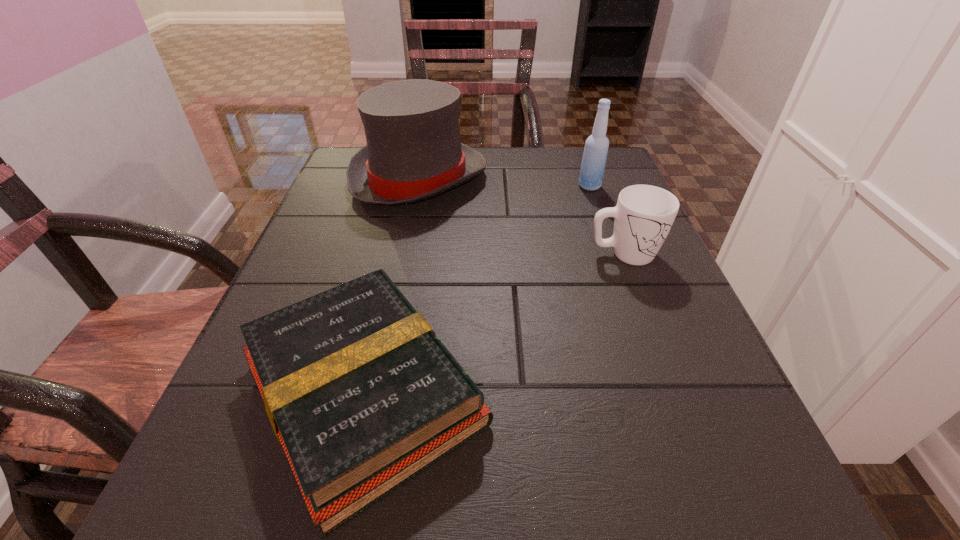
Find the location of a particular element. The image size is (960, 540). unoccupied area between the shortest object and the bottle is located at coordinates (477, 289).

Identify which object is the third nearest to the bottle. Please provide its 2D coordinates. Your answer should be formatted as a tuple, i.e. [(x, y)], where the tuple contains the x and y coordinates of a point satisfying the conditions above.

[(362, 395)]

Locate which object is the third closest to the mug. Please provide its 2D coordinates. Your answer should be formatted as a tuple, i.e. [(x, y)], where the tuple contains the x and y coordinates of a point satisfying the conditions above.

[(414, 152)]